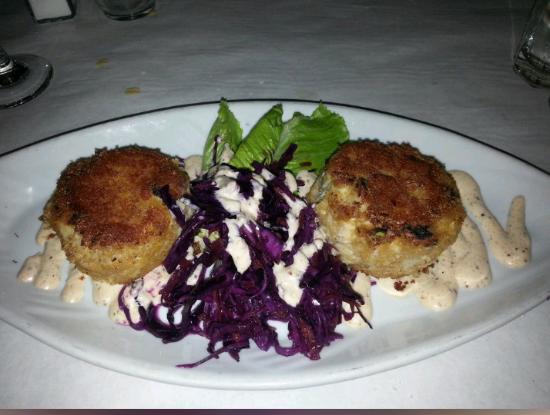
At what (x,y) coordinates should I click in order to perform the action: click on goblet base. Please return your answer as a coordinate pair (x, y). The image size is (550, 415). Looking at the image, I should click on (44, 75).